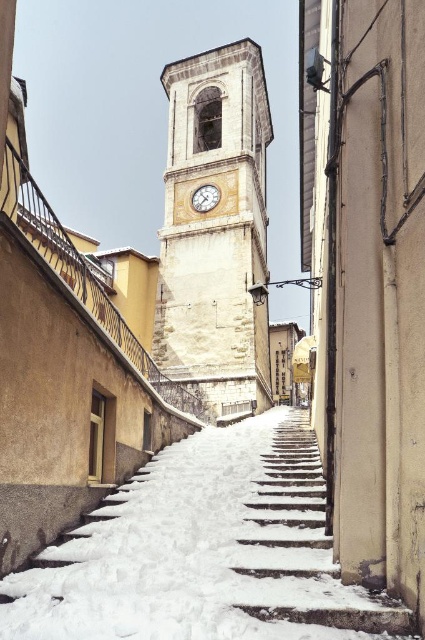
Measure the distance from white powdery snow at center to wooden clock at center.

A distance of 61.68 meters exists between white powdery snow at center and wooden clock at center.

Does white powdery snow at center have a greater width compared to wooden clock at center?

Indeed, white powdery snow at center has a greater width compared to wooden clock at center.

At what (x,y) coordinates should I click in order to perform the action: click on white powdery snow at center. Please return your answer as a coordinate pair (x, y). The image size is (425, 640). Looking at the image, I should click on (204, 552).

The height and width of the screenshot is (640, 425). I want to click on white powdery snow at center, so click(204, 552).

Can you confirm if white stone clock tower at center is positioned above snow-covered stone stairs at center?

Yes, white stone clock tower at center is above snow-covered stone stairs at center.

Is point (232, 244) positioned after point (320, 556)?

Yes, it is behind point (320, 556).

Locate an element on the screen. The width and height of the screenshot is (425, 640). white stone clock tower at center is located at coordinates (215, 228).

Is white stone clock tower at center above wooden clock at center?

Incorrect, white stone clock tower at center is not positioned above wooden clock at center.

Does point (257, 198) come behind point (197, 198)?

That is True.

Where is `white stone clock tower at center`? white stone clock tower at center is located at coordinates (215, 228).

At what (x,y) coordinates should I click in order to perform the action: click on white stone clock tower at center. Please return your answer as a coordinate pair (x, y). Looking at the image, I should click on (215, 228).